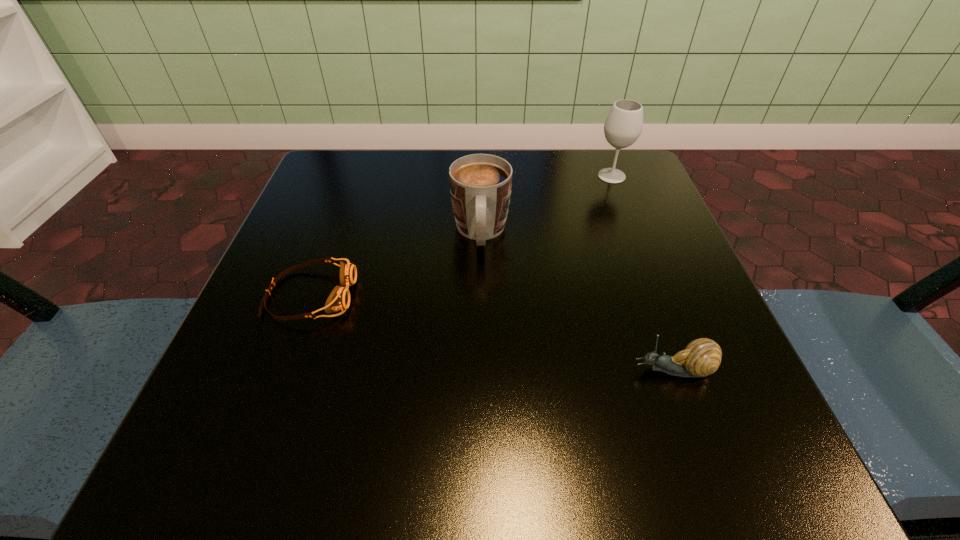
This screenshot has width=960, height=540. What are the coordinates of `vacant point that satisfies the following two spatial constraints: 1. on the front side of the tallest object; 2. with the lenses facing forward on the leftmost object` in the screenshot? It's located at (658, 295).

This screenshot has width=960, height=540. Identify the location of free spot that satisfies the following two spatial constraints: 1. on the side of the second tallest object with the handle; 2. with the lenses facing forward on the leftmost object. (481, 295).

The height and width of the screenshot is (540, 960). I want to click on free location that satisfies the following two spatial constraints: 1. on the side of the third shortest object with the handle; 2. with the lenses facing forward on the goggles, so click(x=481, y=295).

What are the coordinates of `free space that satisfies the following two spatial constraints: 1. on the front side of the tallest object; 2. on the front-facing side of the escargot` in the screenshot? It's located at (686, 370).